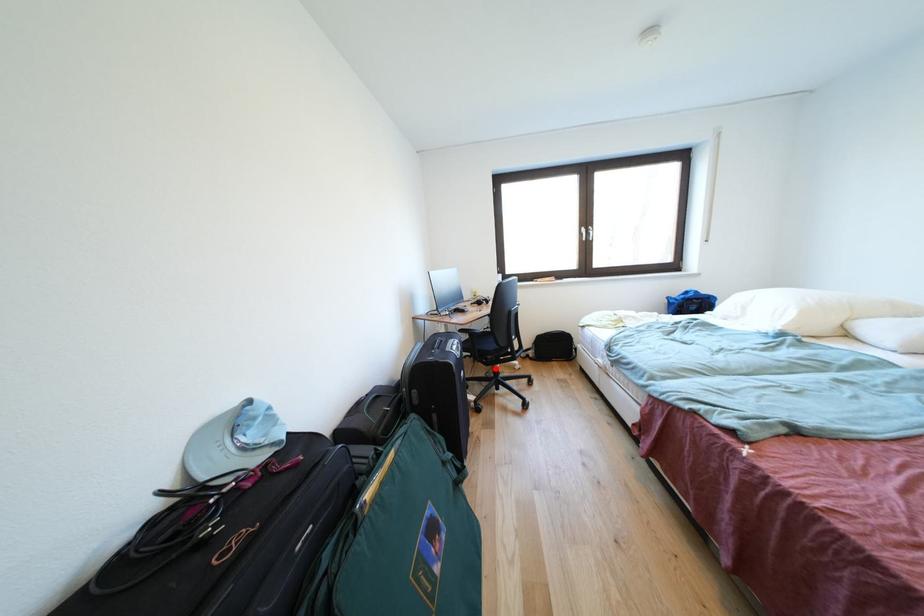
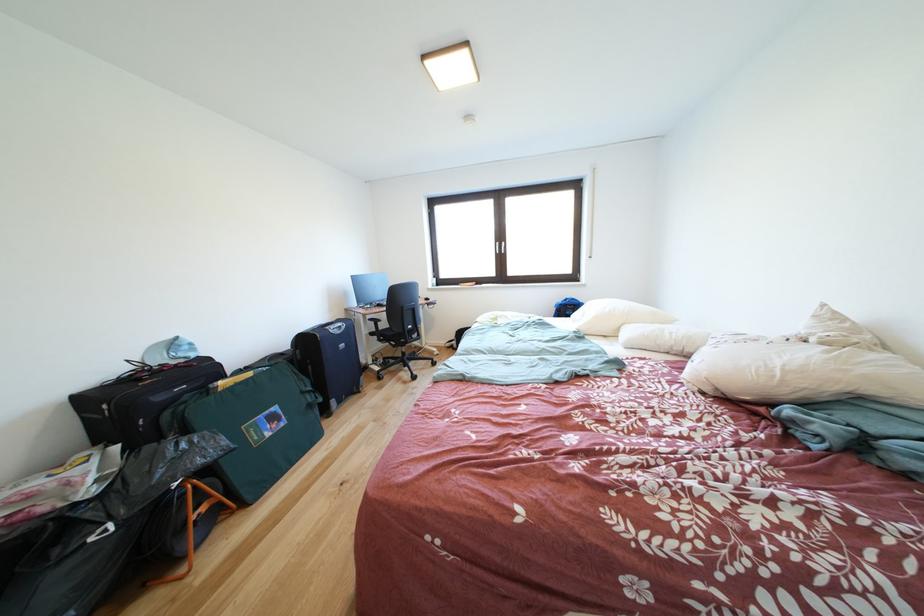
Where in the second image is the point corresponding to the highlighted location from the first image?

(403, 351)